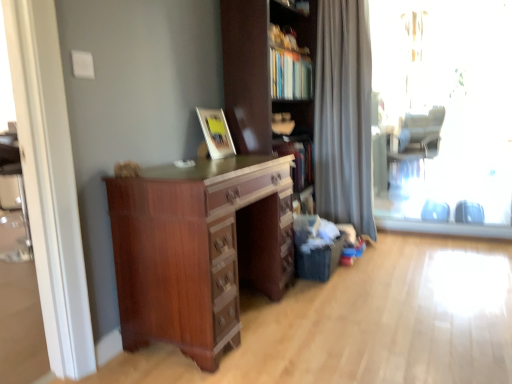
Question: Is mahogany wood chest of drawers at center to the left of matte wooden picture frame at upper center from the viewer's perspective?

Choices:
 (A) no
 (B) yes

Answer: (A)

Question: Is mahogany wood chest of drawers at center outside matte wooden picture frame at upper center?

Choices:
 (A) no
 (B) yes

Answer: (B)

Question: Does mahogany wood chest of drawers at center have a lesser height compared to matte wooden picture frame at upper center?

Choices:
 (A) no
 (B) yes

Answer: (A)

Question: Is mahogany wood chest of drawers at center oriented towards matte wooden picture frame at upper center?

Choices:
 (A) yes
 (B) no

Answer: (B)

Question: Considering the relative sizes of mahogany wood chest of drawers at center and matte wooden picture frame at upper center in the image provided, is mahogany wood chest of drawers at center smaller than matte wooden picture frame at upper center?

Choices:
 (A) yes
 (B) no

Answer: (B)

Question: From the image's perspective, is silky gray curtain at right positioned above or below matte wooden picture frame at upper center?

Choices:
 (A) below
 (B) above

Answer: (B)

Question: Based on their positions, is silky gray curtain at right located to the left or right of matte wooden picture frame at upper center?

Choices:
 (A) left
 (B) right

Answer: (B)

Question: Looking at their shapes, would you say silky gray curtain at right is wider or thinner than matte wooden picture frame at upper center?

Choices:
 (A) thin
 (B) wide

Answer: (B)

Question: Based on their sizes in the image, would you say silky gray curtain at right is bigger or smaller than matte wooden picture frame at upper center?

Choices:
 (A) big
 (B) small

Answer: (A)

Question: In the image, is transparent glass window at right positioned in front of or behind mahogany wood chest of drawers at center?

Choices:
 (A) front
 (B) behind

Answer: (B)

Question: Do you think transparent glass window at right is within mahogany wood chest of drawers at center, or outside of it?

Choices:
 (A) outside
 (B) inside

Answer: (A)

Question: Is point (370, 1) positioned closer to the camera than point (196, 337)?

Choices:
 (A) farther
 (B) closer

Answer: (A)

Question: Is transparent glass window at right taller or shorter than mahogany wood chest of drawers at center?

Choices:
 (A) short
 (B) tall

Answer: (B)

Question: Is point (393, 170) closer or farther from the camera than point (197, 107)?

Choices:
 (A) farther
 (B) closer

Answer: (A)

Question: Based on their sizes in the image, would you say gray fabric swivel chair at right is bigger or smaller than matte wooden picture frame at upper center?

Choices:
 (A) big
 (B) small

Answer: (A)